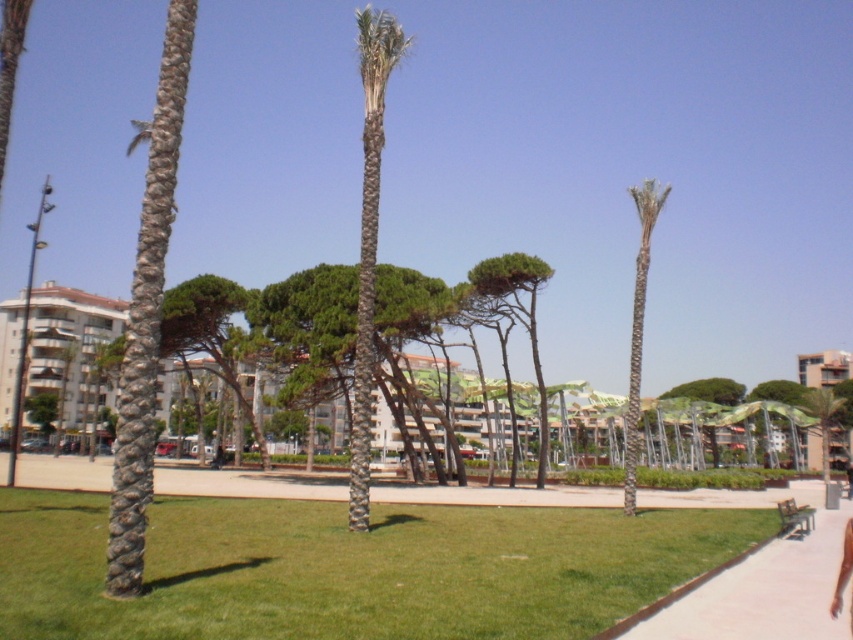
Question: Which object appears farthest from the camera in this image?

Choices:
 (A) white concrete pavement at lower right
 (B) skinny tan skin at lower right
 (C) green grass at center
 (D) gray textured palm tree at left

Answer: (D)

Question: Can you confirm if green leafy palm tree at center is positioned to the left of green textured palm tree at right?

Choices:
 (A) yes
 (B) no

Answer: (A)

Question: Can you confirm if gray textured palm tree at left is positioned above green textured palm tree at right?

Choices:
 (A) yes
 (B) no

Answer: (B)

Question: Among these objects, which one is farthest from the camera?

Choices:
 (A) white concrete pavement at lower right
 (B) skinny tan skin at lower right
 (C) green grass at center

Answer: (A)

Question: Is green leafy palm tree at center bigger than green textured palm tree at right?

Choices:
 (A) yes
 (B) no

Answer: (B)

Question: Based on their relative distances, which object is nearer to the gray textured palm tree at left?

Choices:
 (A) green leafy palm tree at center
 (B) green textured palm tree at right
 (C) skinny tan skin at lower right
 (D) white concrete pavement at lower right

Answer: (A)